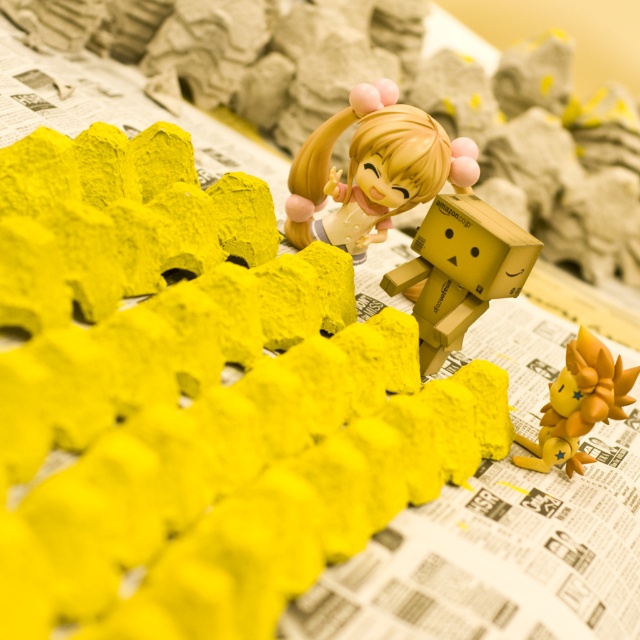
You are a toy collector who wants to place a new toy between the smooth plastic doll at center and the wooden danbo at center. The new toy is 3.5 inches wide. Will there be enough space between them?

The distance between the smooth plastic doll at center and the wooden danbo at center is 4.06 inches. Since the new toy is 3.5 inches wide, there is enough space to place it between them.

Looking at this image, you are looking at the scene from above. There are two points marked as point 1 at coordinates (445, 266) and point 2 at coordinates (600, 374). Which point is closer to you?

Point 1 at coordinates (445, 266) is closer to you because it is in front of point 2 at coordinates (600, 374).

Where is the wooden danbo at center located in terms of coordinates?

The wooden danbo at center is located at coordinates point (460, 269).